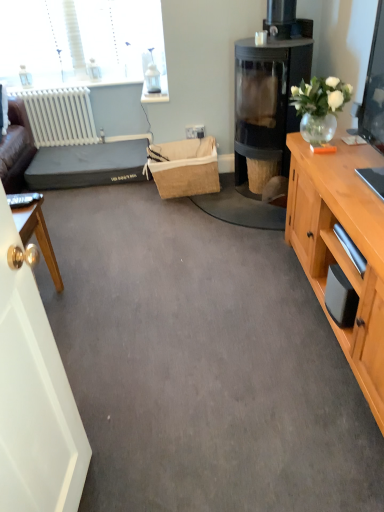
Question: From the image's perspective, is clear glass vase at upper right located beneath polished wood desk at left?

Choices:
 (A) no
 (B) yes

Answer: (A)

Question: Is the depth of clear glass vase at upper right less than that of polished wood desk at left?

Choices:
 (A) no
 (B) yes

Answer: (A)

Question: From the image's perspective, would you say clear glass vase at upper right is positioned over polished wood desk at left?

Choices:
 (A) yes
 (B) no

Answer: (A)

Question: Considering the relative positions of clear glass vase at upper right and polished wood desk at left in the image provided, is clear glass vase at upper right to the left of polished wood desk at left from the viewer's perspective?

Choices:
 (A) no
 (B) yes

Answer: (A)

Question: Is clear glass vase at upper right surrounding polished wood desk at left?

Choices:
 (A) yes
 (B) no

Answer: (B)

Question: Is white matte radiator at left wider or thinner than transparent glass fireplace at upper right?

Choices:
 (A) thin
 (B) wide

Answer: (A)

Question: Is white matte radiator at left bigger or smaller than transparent glass fireplace at upper right?

Choices:
 (A) small
 (B) big

Answer: (A)

Question: Is white matte radiator at left in front of or behind transparent glass fireplace at upper right in the image?

Choices:
 (A) front
 (B) behind

Answer: (B)

Question: From the image's perspective, is white matte radiator at left located above or below transparent glass fireplace at upper right?

Choices:
 (A) below
 (B) above

Answer: (B)

Question: Choose the correct answer: Is white matte radiator at left inside white glossy door at left or outside it?

Choices:
 (A) outside
 (B) inside

Answer: (A)

Question: From the image's perspective, is white matte radiator at left above or below white glossy door at left?

Choices:
 (A) above
 (B) below

Answer: (A)

Question: Does point (87, 109) appear closer or farther from the camera than point (82, 437)?

Choices:
 (A) closer
 (B) farther

Answer: (B)

Question: Considering the positions of white matte radiator at left and white glossy door at left in the image, is white matte radiator at left taller or shorter than white glossy door at left?

Choices:
 (A) short
 (B) tall

Answer: (A)

Question: From their relative heights in the image, would you say wooden drawer at right is taller or shorter than polished wood desk at left?

Choices:
 (A) short
 (B) tall

Answer: (A)

Question: From a real-world perspective, is wooden drawer at right above or below polished wood desk at left?

Choices:
 (A) below
 (B) above

Answer: (B)